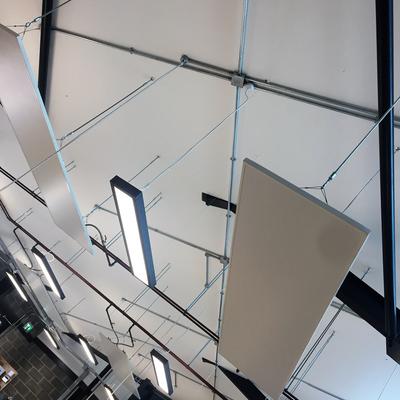
Locate an element on the screen. lights that are on is located at coordinates click(137, 251), click(158, 373), click(108, 394), click(89, 354), click(50, 340), click(20, 292), click(50, 274).